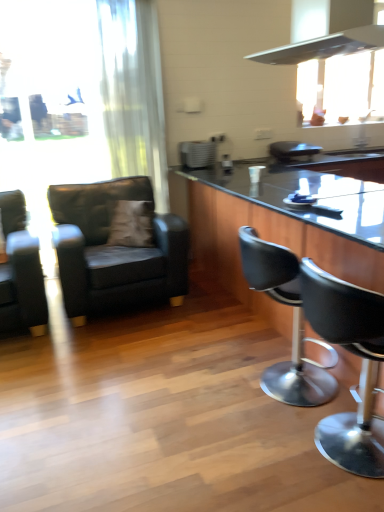
Where is `empty space that is in between matte black armchair at left, the 1th chair when ordered from left to right, and black leather bar stool at center, the third chair from the left`? This screenshot has width=384, height=512. empty space that is in between matte black armchair at left, the 1th chair when ordered from left to right, and black leather bar stool at center, the third chair from the left is located at coordinates tap(165, 357).